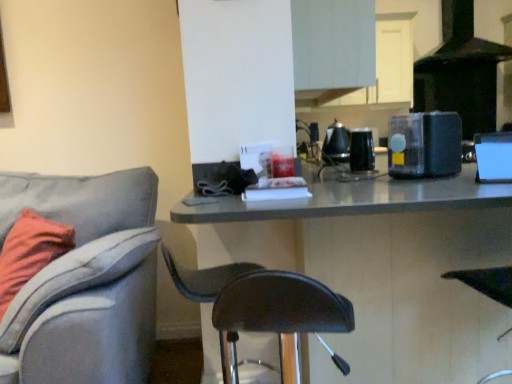
Question: Is black glossy kettle at upper center, which is the fourth appliance in front-to-back order, taller or shorter than black glossy coffee maker at upper center, which ranks as the third appliance in front-to-back order?

Choices:
 (A) tall
 (B) short

Answer: (A)

Question: From a real-world perspective, relative to black glossy coffee maker at upper center, marked as the 2th appliance in a back-to-front arrangement, is black glossy kettle at upper center, marked as the 1th appliance in a back-to-front arrangement, vertically above or below?

Choices:
 (A) above
 (B) below

Answer: (A)

Question: Estimate the real-world distances between objects in this image. Which object is farther from the matte gray table at center?

Choices:
 (A) black glossy kettle at upper center, marked as the 1th appliance in a back-to-front arrangement
 (B) light gray fabric chair at left, which ranks as the 1th chair in left-to-right order
 (C) black leather chair at center, placed as the second chair when sorted from left to right
 (D) black glossy coffee maker at upper center, which ranks as the third appliance in front-to-back order
 (E) black matte exhaust hood at upper right

Answer: (E)

Question: Which is nearer to the black glossy coffee maker at upper center, marked as the 2th appliance in a back-to-front arrangement?

Choices:
 (A) blue glossy speaker at right, which is the fourth appliance in back-to-front order
 (B) black matte exhaust hood at upper right
 (C) matte gray table at center
 (D) light gray fabric chair at left, which ranks as the 1th chair in left-to-right order
 (E) black glossy kettle at upper center, marked as the 1th appliance in a back-to-front arrangement

Answer: (E)